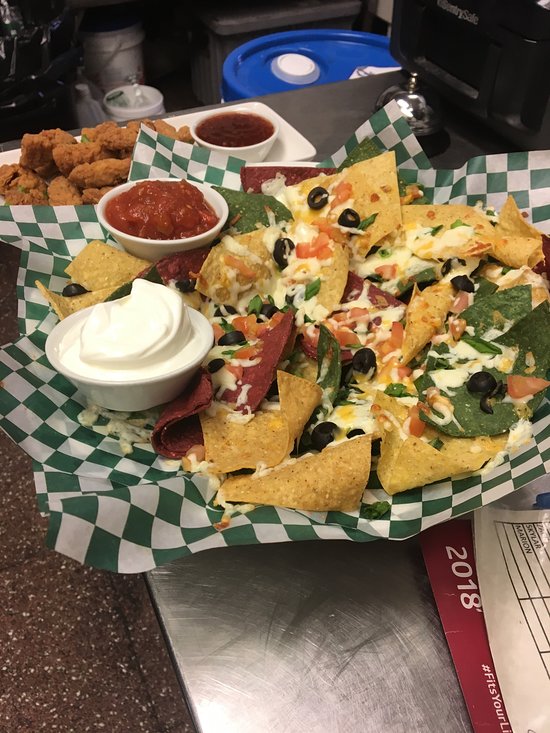
Identify the location of calendar. Image resolution: width=550 pixels, height=733 pixels. (464, 622).